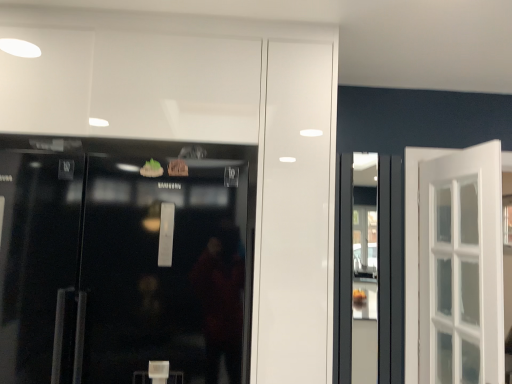
The height and width of the screenshot is (384, 512). What do you see at coordinates (365, 270) in the screenshot?
I see `transparent glass shop window at center` at bounding box center [365, 270].

At what (x,y) coordinates should I click in order to perform the action: click on transparent glass shop window at center. Please return your answer as a coordinate pair (x, y). The width and height of the screenshot is (512, 384). Looking at the image, I should click on (x=365, y=270).

Where is `black glass refrigerator at left`? Image resolution: width=512 pixels, height=384 pixels. black glass refrigerator at left is located at coordinates (124, 260).

What do you see at coordinates (124, 260) in the screenshot? I see `black glass refrigerator at left` at bounding box center [124, 260].

Identify the location of transparent glass shop window at center. (365, 270).

Is transparent glass shop window at center at the right side of black glass refrigerator at left?

Indeed, transparent glass shop window at center is positioned on the right side of black glass refrigerator at left.

Is transparent glass shop window at center positioned before black glass refrigerator at left?

No, transparent glass shop window at center is further to the viewer.

Which is further, (368, 249) or (22, 138)?

Positioned behind is point (368, 249).

From the image's perspective, relative to black glass refrigerator at left, is transparent glass shop window at center above or below?

Clearly, from the image's perspective, transparent glass shop window at center is below black glass refrigerator at left.

From a real-world perspective, relative to black glass refrigerator at left, is transparent glass shop window at center vertically above or below?

In terms of real-world spatial position, transparent glass shop window at center is below black glass refrigerator at left.

Considering the sizes of objects transparent glass shop window at center and black glass refrigerator at left in the image provided, who is wider, transparent glass shop window at center or black glass refrigerator at left?

Wider between the two is black glass refrigerator at left.

From their relative heights in the image, would you say transparent glass shop window at center is taller or shorter than black glass refrigerator at left?

transparent glass shop window at center is taller than black glass refrigerator at left.

Does transparent glass shop window at center have a smaller size compared to black glass refrigerator at left?

Indeed, transparent glass shop window at center has a smaller size compared to black glass refrigerator at left.

Could black glass refrigerator at left be considered to be inside transparent glass shop window at center?

No, black glass refrigerator at left is located outside of transparent glass shop window at center.

Is transparent glass shop window at center not near black glass refrigerator at left?

Yes, transparent glass shop window at center and black glass refrigerator at left are located far from each other.

Is transparent glass shop window at center facing towards black glass refrigerator at left?

No, transparent glass shop window at center is not turned towards black glass refrigerator at left.

The height and width of the screenshot is (384, 512). What are the coordinates of `door located above the transparent glass shop window at center (from a real-world perspective)` in the screenshot? It's located at (124, 260).

Between black glass refrigerator at left and transparent glass shop window at center, which one appears on the right side from the viewer's perspective?

Positioned to the right is transparent glass shop window at center.

Does black glass refrigerator at left come in front of transparent glass shop window at center?

Yes, it is in front of transparent glass shop window at center.

Is point (249, 158) positioned before point (375, 199)?

Yes.

Based on the photo, from the image's perspective, which one is positioned lower, black glass refrigerator at left or transparent glass shop window at center?

transparent glass shop window at center.

From a real-world perspective, between black glass refrigerator at left and transparent glass shop window at center, who is vertically higher?

black glass refrigerator at left.

Can you confirm if black glass refrigerator at left is wider than transparent glass shop window at center?

Correct, the width of black glass refrigerator at left exceeds that of transparent glass shop window at center.

Which of these two, black glass refrigerator at left or transparent glass shop window at center, stands taller?

Standing taller between the two is transparent glass shop window at center.

Does black glass refrigerator at left have a larger size compared to transparent glass shop window at center?

Yes.

Would you say black glass refrigerator at left is outside transparent glass shop window at center?

Yes.

Are black glass refrigerator at left and transparent glass shop window at center making contact?

black glass refrigerator at left and transparent glass shop window at center are not in contact.

Is black glass refrigerator at left positioned with its back to transparent glass shop window at center?

No, black glass refrigerator at left is not facing away from transparent glass shop window at center.

Locate an element on the screen. shop window located on the right of black glass refrigerator at left is located at coordinates (365, 270).

Locate an element on the screen. This screenshot has width=512, height=384. door above the transparent glass shop window at center (from the image's perspective) is located at coordinates [124, 260].

The width and height of the screenshot is (512, 384). In order to click on shop window directly beneath the black glass refrigerator at left (from a real-world perspective) in this screenshot , I will do `click(365, 270)`.